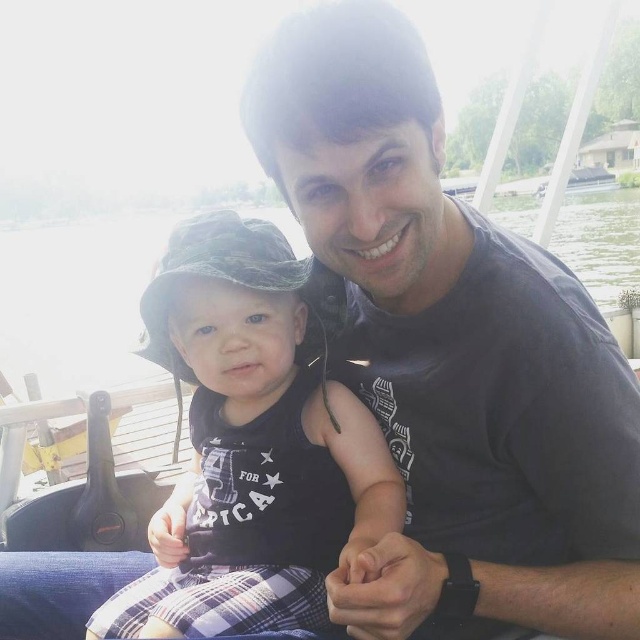
Question: Which object is farther from the camera taking this photo?

Choices:
 (A) transparent water at center
 (B) camouflage fabric hat at left

Answer: (A)

Question: Does camouflage fabric hat at left have a larger size compared to transparent water at center?

Choices:
 (A) yes
 (B) no

Answer: (B)

Question: Can you confirm if camouflage fabric hat at left is positioned to the left of transparent water at center?

Choices:
 (A) yes
 (B) no

Answer: (A)

Question: Which of the following is the closest to the observer?

Choices:
 (A) transparent water at center
 (B) camouflage fabric hat at left

Answer: (B)

Question: From the image, what is the correct spatial relationship of camouflage fabric hat at left in relation to transparent water at center?

Choices:
 (A) left
 (B) right

Answer: (A)